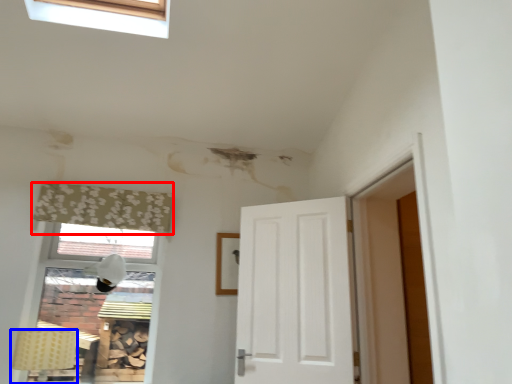
Question: Which object appears farthest to the camera in this image, curtain (highlighted by a red box) or lamp (highlighted by a blue box)?

Choices:
 (A) curtain
 (B) lamp

Answer: (A)